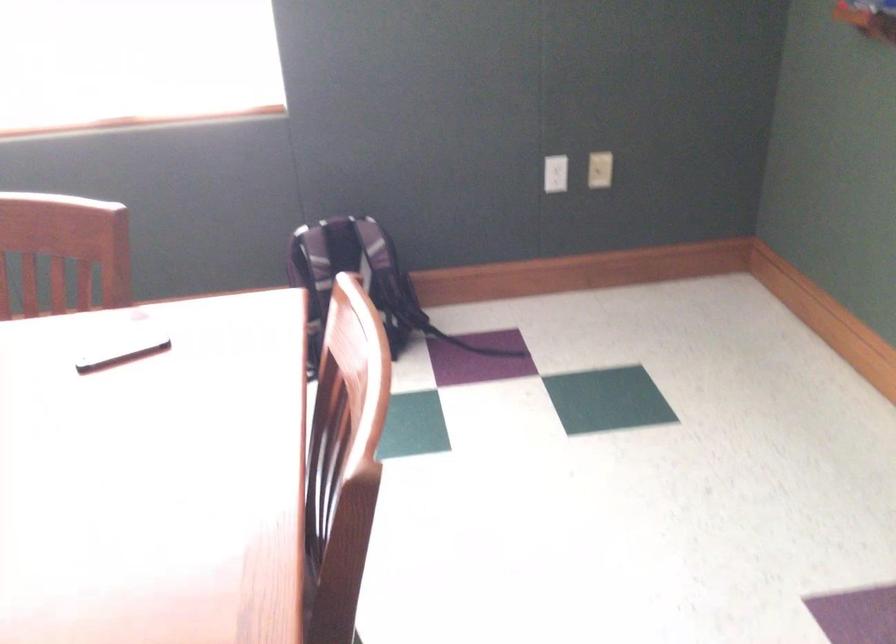
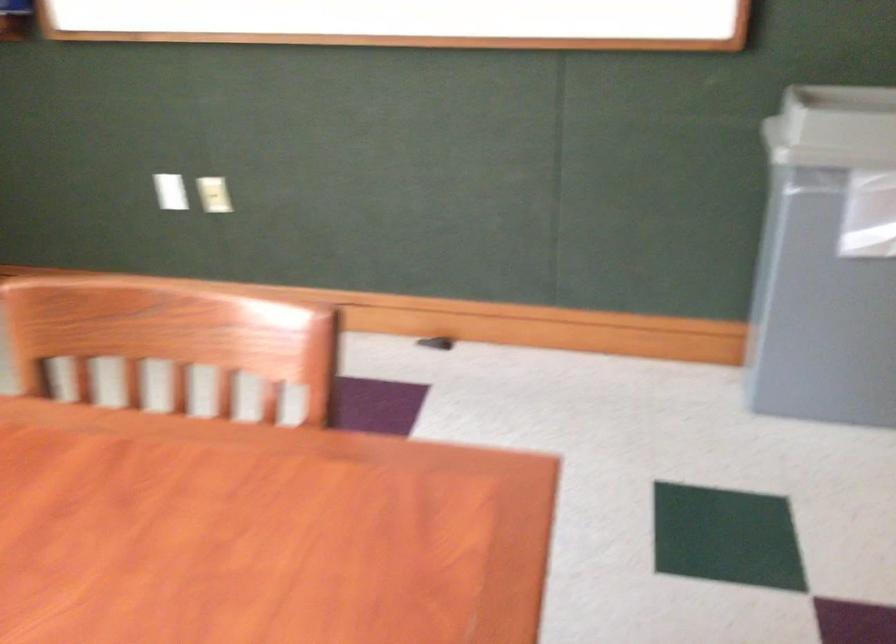
Question: Based on the continuous images, in which direction is the camera rotating? Reply with the corresponding letter.

Choices:
 (A) Left
 (B) Right
 (C) Up
 (D) Down

Answer: (B)